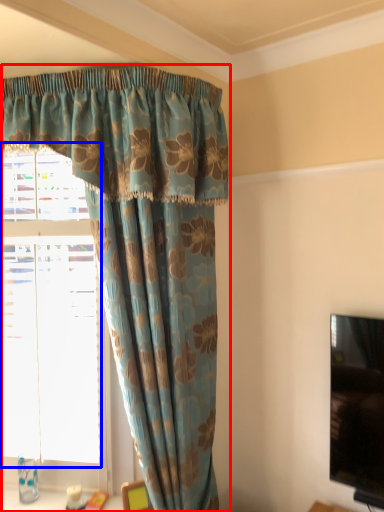
Question: Among these objects, which one is farthest to the camera, curtain (highlighted by a red box) or bay window (highlighted by a blue box)?

Choices:
 (A) curtain
 (B) bay window

Answer: (B)